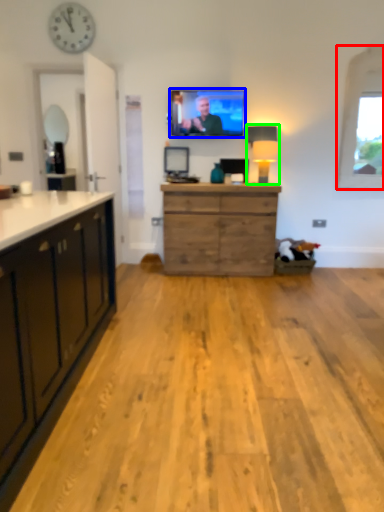
Question: Based on their relative distances, which object is farther from window (highlighted by a red box)? Choose from television (highlighted by a blue box) and lamp (highlighted by a green box).

Choices:
 (A) television
 (B) lamp

Answer: (A)